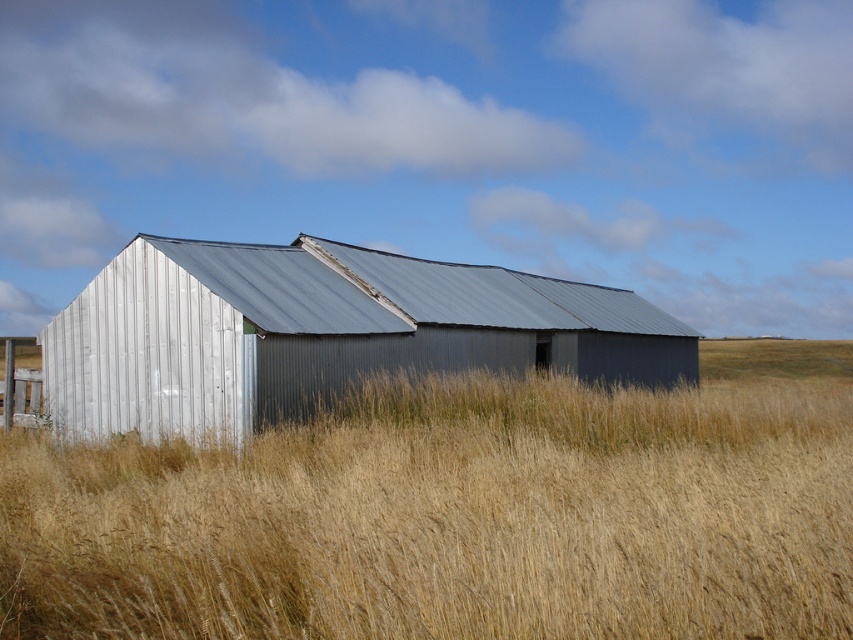
Question: Which point is farther to the camera?

Choices:
 (A) metallic silver barn at center
 (B) golden dry grass at center

Answer: (A)

Question: Is golden dry grass at center positioned before metallic silver barn at center?

Choices:
 (A) yes
 (B) no

Answer: (A)

Question: Considering the relative positions of golden dry grass at center and metallic silver barn at center in the image provided, where is golden dry grass at center located with respect to metallic silver barn at center?

Choices:
 (A) above
 (B) below

Answer: (B)

Question: Is golden dry grass at center wider than metallic silver barn at center?

Choices:
 (A) no
 (B) yes

Answer: (B)

Question: Which of the following is the farthest from the observer?

Choices:
 (A) metallic silver barn at center
 (B) golden dry grass at center

Answer: (A)